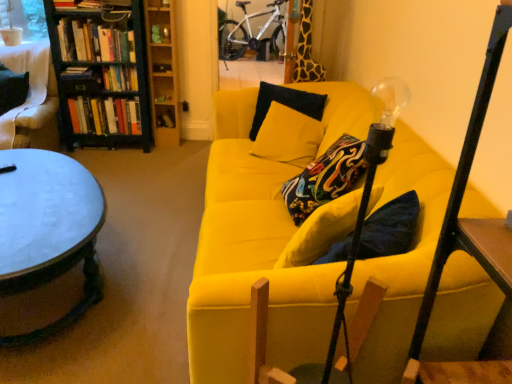
Where is `vacant space to the right of wooden bookcase at upper center, the 2th bookcase when ordered from left to right`? vacant space to the right of wooden bookcase at upper center, the 2th bookcase when ordered from left to right is located at coordinates (195, 141).